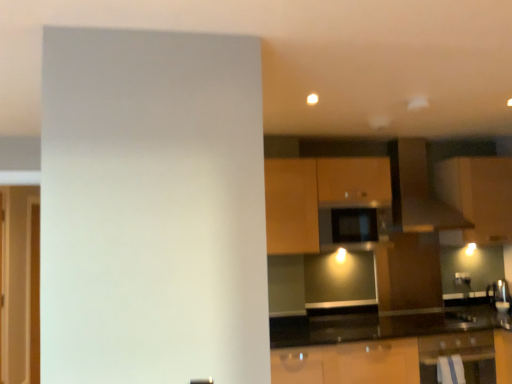
Question: Which direction should I rotate to look at matte brown cabinet at center, which is counted as the 2th cabinetry, starting from the right, — up or down?

Choices:
 (A) down
 (B) up

Answer: (A)

Question: Is wooden cabinet at center, the 1th cabinetry from the left, not close to black matte microwave at center?

Choices:
 (A) yes
 (B) no

Answer: (B)

Question: Is wooden cabinet at center, which appears as the third cabinetry when viewed from the right, taller than black matte microwave at center?

Choices:
 (A) yes
 (B) no

Answer: (A)

Question: From a real-world perspective, is wooden cabinet at center, which appears as the third cabinetry when viewed from the right, physically below black matte microwave at center?

Choices:
 (A) no
 (B) yes

Answer: (A)

Question: From a real-world perspective, is wooden cabinet at center, which appears as the third cabinetry when viewed from the right, physically above black matte microwave at center?

Choices:
 (A) yes
 (B) no

Answer: (A)

Question: Could you tell me if wooden cabinet at center, the 1th cabinetry from the left, is turned towards black matte microwave at center?

Choices:
 (A) yes
 (B) no

Answer: (A)

Question: From the image's perspective, is wooden cabinet at center, the 1th cabinetry from the left, located above black matte microwave at center?

Choices:
 (A) yes
 (B) no

Answer: (A)

Question: Is wooden cabinet at center, the 1th cabinetry from the left, placed right next to transparent glass door at left?

Choices:
 (A) yes
 (B) no

Answer: (B)

Question: Does wooden cabinet at center, the 1th cabinetry from the left, have a lesser height compared to transparent glass door at left?

Choices:
 (A) yes
 (B) no

Answer: (A)

Question: From a real-world perspective, is wooden cabinet at center, which appears as the third cabinetry when viewed from the right, positioned over transparent glass door at left based on gravity?

Choices:
 (A) no
 (B) yes

Answer: (B)

Question: Considering the relative sizes of wooden cabinet at center, the 1th cabinetry from the left, and transparent glass door at left in the image provided, is wooden cabinet at center, the 1th cabinetry from the left, bigger than transparent glass door at left?

Choices:
 (A) yes
 (B) no

Answer: (A)

Question: Would you say transparent glass door at left is part of wooden cabinet at center, which appears as the third cabinetry when viewed from the right,'s contents?

Choices:
 (A) no
 (B) yes

Answer: (A)

Question: Is wooden cabinet at center, which appears as the third cabinetry when viewed from the right, to the left of transparent glass door at left from the viewer's perspective?

Choices:
 (A) yes
 (B) no

Answer: (B)

Question: From a real-world perspective, is matte brown cabinet at upper right, the 3th cabinetry from the left, physically below matte brown cabinet at center, which is counted as the 2th cabinetry, starting from the right?

Choices:
 (A) no
 (B) yes

Answer: (A)